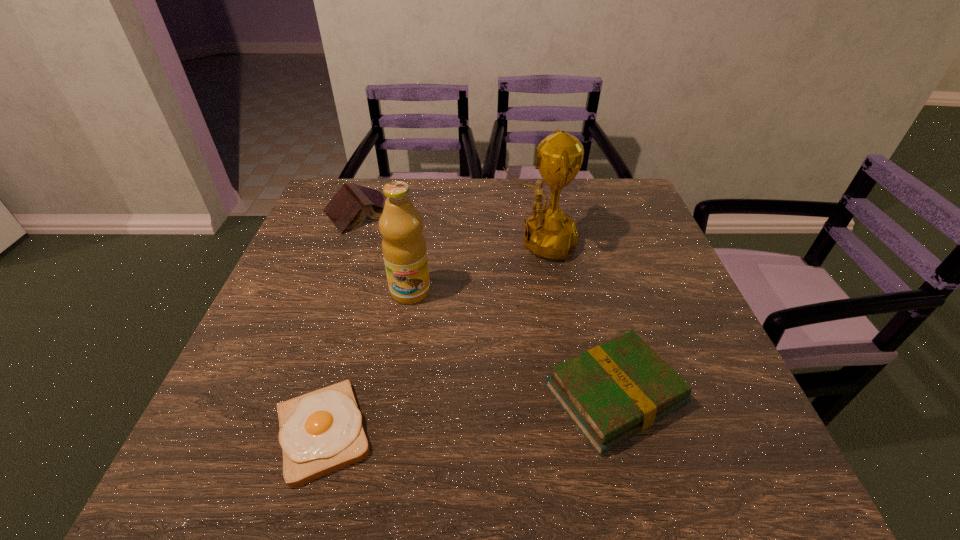
Locate an element on the screen. free space located 0.160m on the back of the nearer book is located at coordinates click(588, 292).

Identify the location of vacant space situated on the right of the shortest object. The image size is (960, 540). (551, 431).

What are the coordinates of `award that is at the far edge` in the screenshot? It's located at (549, 233).

Locate an element on the screen. This screenshot has width=960, height=540. book at the far edge is located at coordinates (347, 209).

This screenshot has width=960, height=540. What are the coordinates of `book that is at the near edge` in the screenshot? It's located at (611, 392).

Where is `toast that is at the near edge`? The width and height of the screenshot is (960, 540). toast that is at the near edge is located at coordinates (320, 432).

Find the location of a particular element. The image size is (960, 540). book that is positioned at the left edge is located at coordinates (347, 209).

Where is `toast present at the left edge`? toast present at the left edge is located at coordinates (320, 432).

Where is `object that is at the right edge`? object that is at the right edge is located at coordinates (611, 392).

At what (x,y) coordinates should I click in order to perform the action: click on object present at the far left corner. Please return your answer as a coordinate pair (x, y). The width and height of the screenshot is (960, 540). Looking at the image, I should click on (347, 209).